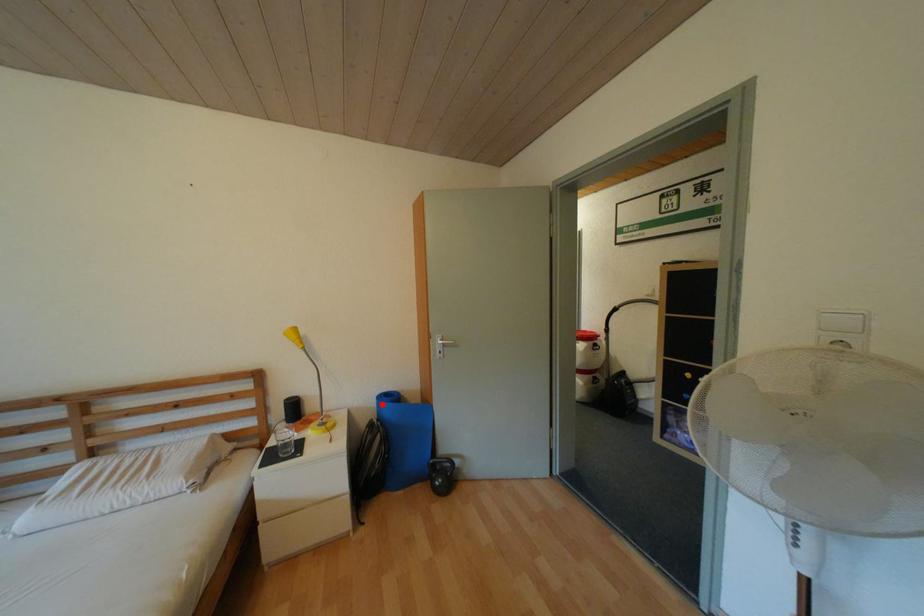
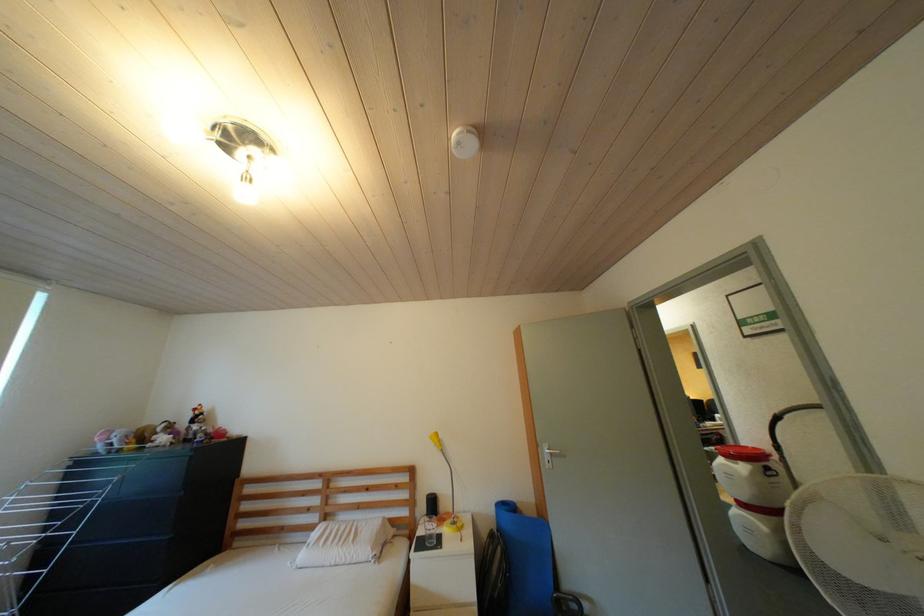
Where in the second image is the point corresponding to the highlighted location from the first image?

(502, 512)